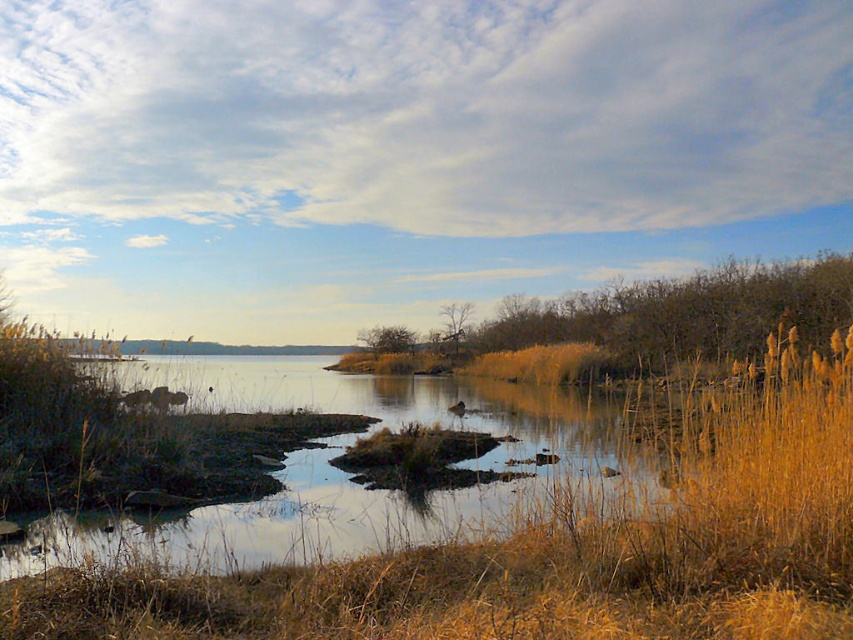
How distant is brown grassy river at center from brown textured tree at center?

28.05 meters

Is point (297, 452) farther from viewer compared to point (444, 337)?

No, (297, 452) is in front of (444, 337).

This screenshot has width=853, height=640. What are the coordinates of `brown grassy river at center` in the screenshot? It's located at (352, 474).

Does point (648, 310) come behind point (380, 330)?

That is False.

Is the position of brown textured tree at right less distant than that of green leafy tree at center?

Yes, brown textured tree at right is closer to the viewer.

Which is in front, point (624, 301) or point (389, 336)?

Point (624, 301) is more forward.

Where is `brown textured tree at right`? The width and height of the screenshot is (853, 640). brown textured tree at right is located at coordinates (682, 314).

Between point (473, 419) and point (410, 337), which one is positioned in front?

Positioned in front is point (473, 419).

Is point (198, 388) positioned behind point (381, 337)?

No, (198, 388) is closer to viewer.

Where is `brown grassy river at center`? The image size is (853, 640). brown grassy river at center is located at coordinates (352, 474).